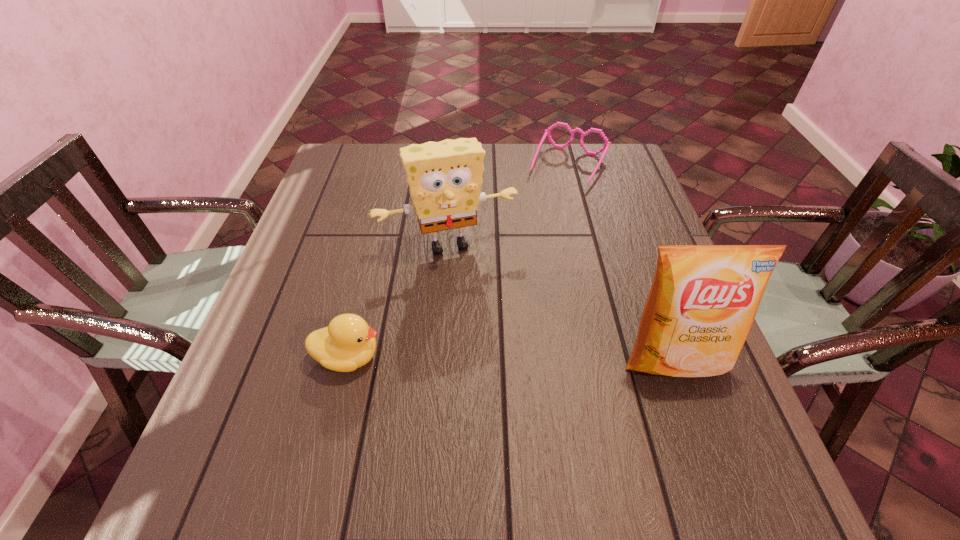
The width and height of the screenshot is (960, 540). What are the coordinates of `the second shortest object` in the screenshot? It's located at (348, 343).

Identify the location of crisp (potato chip). This screenshot has height=540, width=960. (703, 300).

Locate an element on the screen. This screenshot has width=960, height=540. sponge is located at coordinates (445, 177).

Locate an element on the screen. The height and width of the screenshot is (540, 960). the shortest object is located at coordinates (547, 132).

Locate an element on the screen. The height and width of the screenshot is (540, 960). the farthest object is located at coordinates (547, 132).

This screenshot has width=960, height=540. Find the location of `vacant space located on the beak of the third tallest object`. vacant space located on the beak of the third tallest object is located at coordinates (566, 357).

You are a GUI agent. You are given a task and a screenshot of the screen. Output one action in this format:
    pyautogui.click(x=<x>, y=<y>)
    Task: Click on the vacant space situated 0.050m on the front-facing side of the crisp (potato chip)
    The height and width of the screenshot is (540, 960).
    Given the screenshot: What is the action you would take?
    pos(693,414)

Where is `vacant space located 0.400m on the face of the sponge`? vacant space located 0.400m on the face of the sponge is located at coordinates (519, 414).

You are a GUI agent. You are given a task and a screenshot of the screen. Output one action in this format:
    pyautogui.click(x=<x>, y=<y>)
    Task: Click on the vacant space located 0.050m on the face of the sponge
    The height and width of the screenshot is (540, 960).
    Given the screenshot: What is the action you would take?
    pyautogui.click(x=470, y=277)

Identify the location of free point located on the face of the sponge. (479, 302).